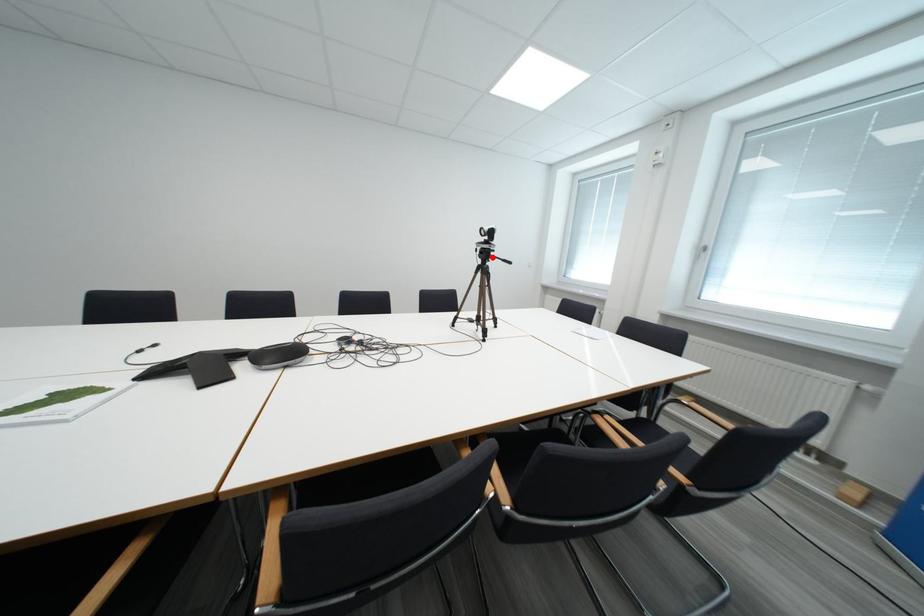
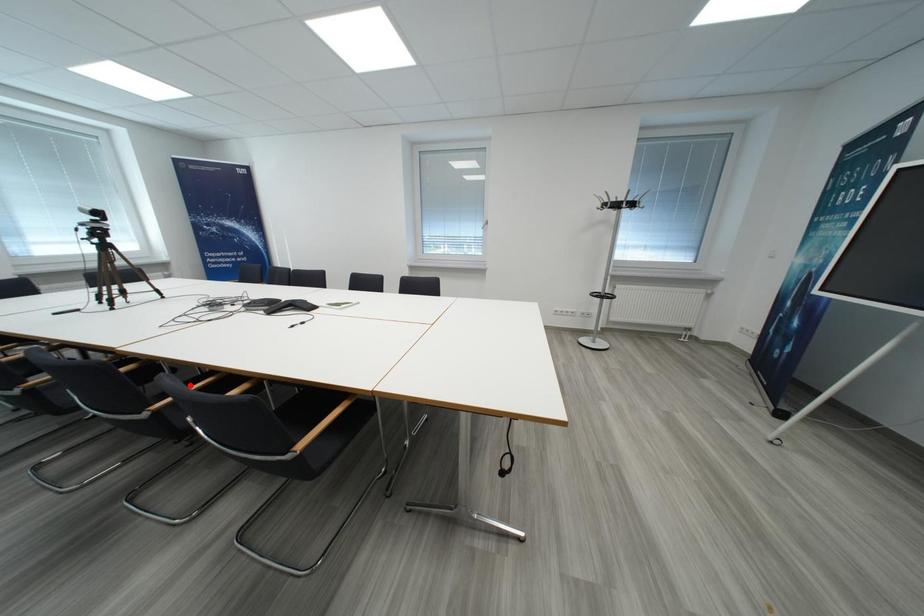
I am providing you with two images of the same scene from different viewpoints. A red point is marked on the first image and another point is marked on the second image. Are the points marked in image1 and image2 representing the same 3D position?

No